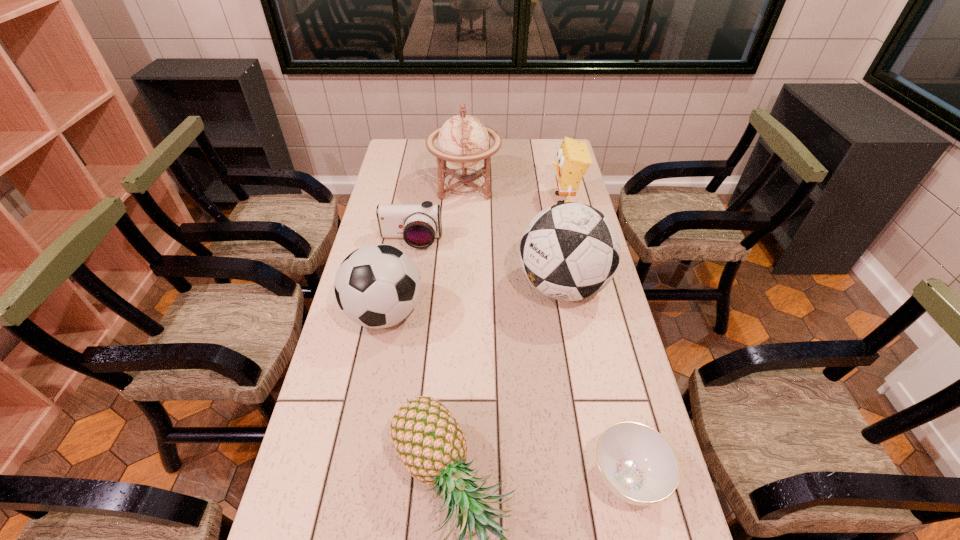
The image size is (960, 540). In order to click on vacant area situated on the surface of the sixth shortest object where the brand logo is visible in this screenshot , I will do `click(417, 286)`.

At what (x,y) coordinates should I click in order to perform the action: click on vacant area located on the surface of the sixth shortest object where the brand logo is visible. Please return your answer as a coordinate pair (x, y). Looking at the image, I should click on (429, 286).

Find the location of `free space located 0.190m on the right of the shorter soccer ball`. free space located 0.190m on the right of the shorter soccer ball is located at coordinates (488, 314).

Identify the location of free space located on the face of the sponge. (473, 199).

Locate an element on the screen. free space located on the face of the sponge is located at coordinates (509, 199).

Locate an element on the screen. The image size is (960, 540). vacant area situated on the face of the sponge is located at coordinates (519, 199).

The height and width of the screenshot is (540, 960). I want to click on vacant point located 0.330m on the surface of the second shortest object, so click(x=396, y=327).

Find the location of a particular element. Image resolution: width=960 pixels, height=540 pixels. free space located 0.220m on the back of the shortest object is located at coordinates (601, 362).

Locate an element on the screen. soccer ball that is positioned at the left edge is located at coordinates pyautogui.click(x=377, y=286).

I want to click on camcorder located in the left edge section of the desktop, so click(419, 225).